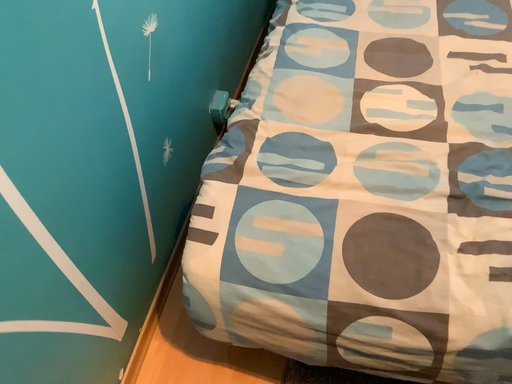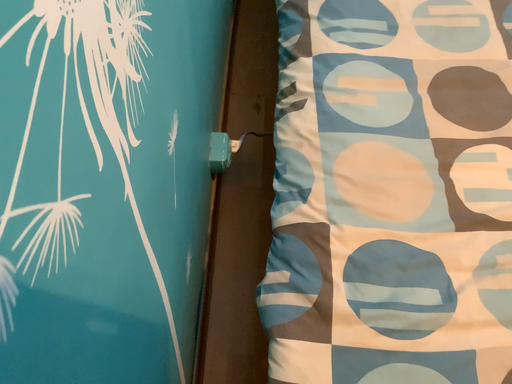
Question: Which way did the camera rotate in the video?

Choices:
 (A) rotated downward
 (B) rotated upward

Answer: (A)